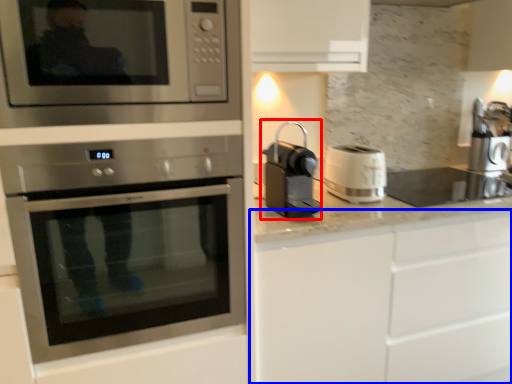
Question: Which object is further to the camera taking this photo, coffee machine (highlighted by a red box) or cabinetry (highlighted by a blue box)?

Choices:
 (A) coffee machine
 (B) cabinetry

Answer: (B)